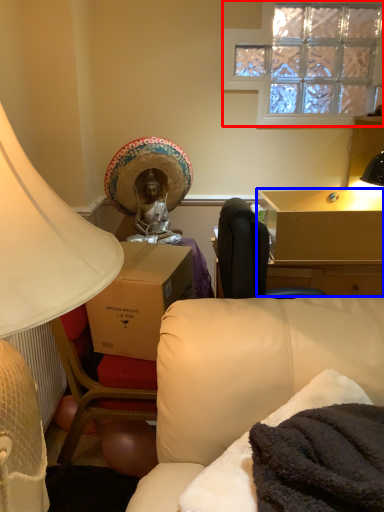
Question: Which point is further to the camera, window (highlighted by a red box) or table (highlighted by a blue box)?

Choices:
 (A) window
 (B) table

Answer: (A)